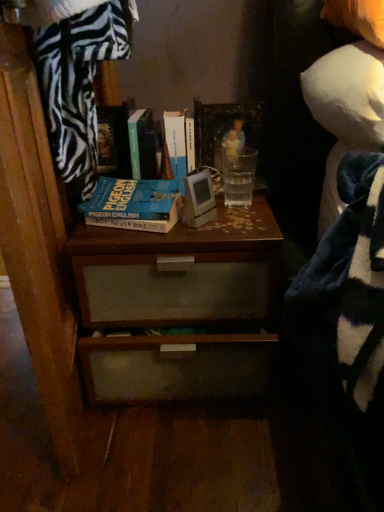
Question: Considering the relative sizes of green matte book at upper center, arranged as the 2th book when viewed from the left, and hardcover book at center, marked as the 3th book in a left-to-right arrangement, in the image provided, is green matte book at upper center, arranged as the 2th book when viewed from the left, thinner than hardcover book at center, marked as the 3th book in a left-to-right arrangement,?

Choices:
 (A) yes
 (B) no

Answer: (B)

Question: Is green matte book at upper center, arranged as the 2th book when viewed from the left, completely or partially outside of hardcover book at center, the 1th book positioned from the right?

Choices:
 (A) yes
 (B) no

Answer: (A)

Question: From a real-world perspective, is green matte book at upper center, arranged as the 2th book when viewed from the left, physically below hardcover book at center, marked as the 3th book in a left-to-right arrangement?

Choices:
 (A) no
 (B) yes

Answer: (A)

Question: Considering the relative sizes of green matte book at upper center, arranged as the 2th book when viewed from the left, and hardcover book at center, marked as the 3th book in a left-to-right arrangement, in the image provided, is green matte book at upper center, arranged as the 2th book when viewed from the left, bigger than hardcover book at center, marked as the 3th book in a left-to-right arrangement,?

Choices:
 (A) yes
 (B) no

Answer: (B)

Question: Is green matte book at upper center, arranged as the 2th book when viewed from the left, looking in the opposite direction of hardcover book at center, marked as the 3th book in a left-to-right arrangement?

Choices:
 (A) no
 (B) yes

Answer: (A)

Question: Considering the relative sizes of green matte book at upper center, arranged as the 2th book when viewed from the left, and hardcover book at center, the 1th book positioned from the right, in the image provided, is green matte book at upper center, arranged as the 2th book when viewed from the left, smaller than hardcover book at center, the 1th book positioned from the right,?

Choices:
 (A) yes
 (B) no

Answer: (A)

Question: Is green matte book at upper center, arranged as the 2th book when viewed from the left, at the right side of wooden picture frame at center?

Choices:
 (A) no
 (B) yes

Answer: (A)

Question: Considering the relative sizes of green matte book at upper center, arranged as the 2th book when viewed from the left, and wooden picture frame at center in the image provided, is green matte book at upper center, arranged as the 2th book when viewed from the left, thinner than wooden picture frame at center?

Choices:
 (A) no
 (B) yes

Answer: (A)

Question: From a real-world perspective, is green matte book at upper center, arranged as the 2th book when viewed from the left, on wooden picture frame at center?

Choices:
 (A) yes
 (B) no

Answer: (A)

Question: Is green matte book at upper center, arranged as the 2th book when viewed from the left, completely or partially outside of wooden picture frame at center?

Choices:
 (A) no
 (B) yes

Answer: (B)

Question: Is wooden picture frame at center located within green matte book at upper center, arranged as the 2th book when viewed from the left?

Choices:
 (A) yes
 (B) no

Answer: (B)

Question: Considering the relative sizes of green matte book at upper center, which is counted as the second book, starting from the right, and wooden picture frame at center in the image provided, is green matte book at upper center, which is counted as the second book, starting from the right, smaller than wooden picture frame at center?

Choices:
 (A) yes
 (B) no

Answer: (B)

Question: Is wooden picture frame at center to the left of blue matte book at center, placed as the third book when sorted from right to left, from the viewer's perspective?

Choices:
 (A) yes
 (B) no

Answer: (B)